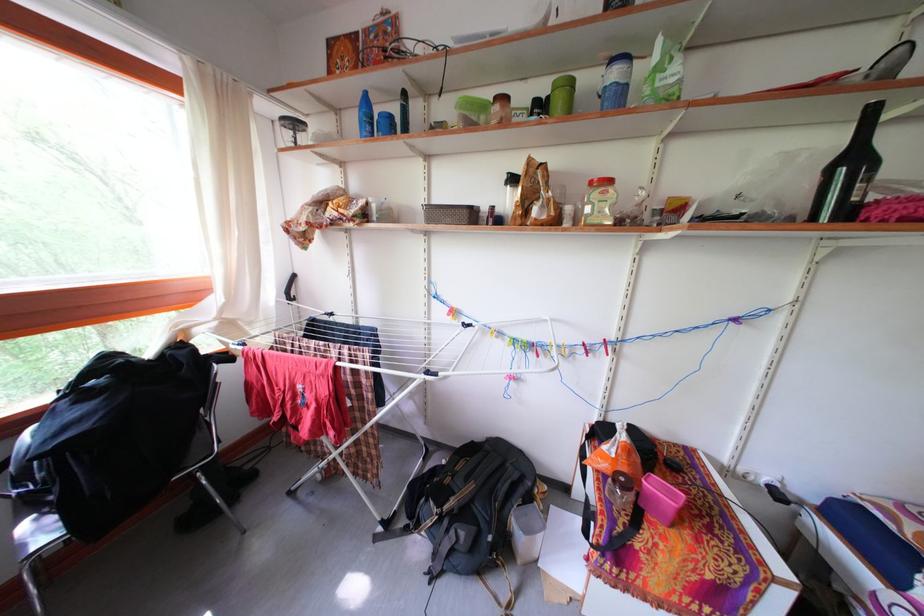
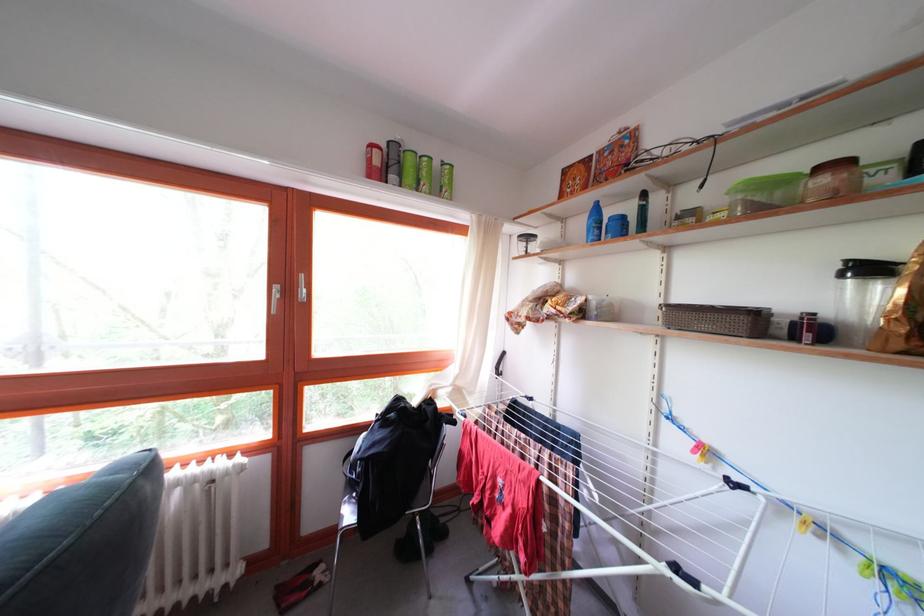
In the second image, find the point that corresponds to point 434,211 in the first image.

(675, 312)